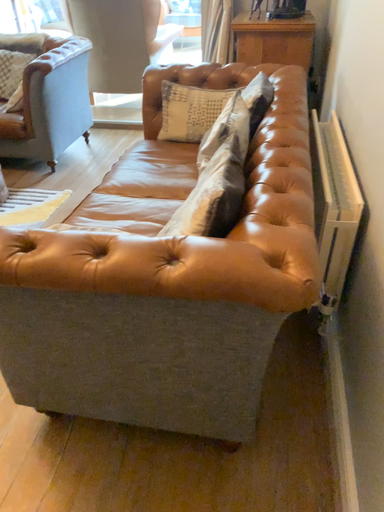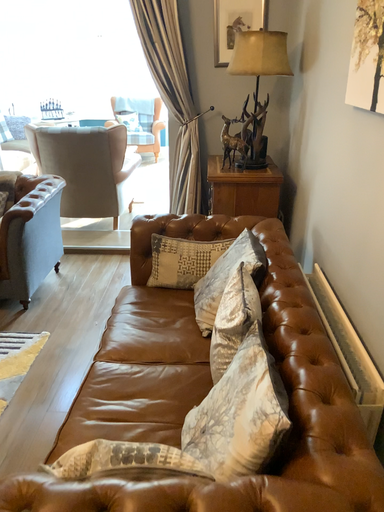
Question: Which way did the camera rotate in the video?

Choices:
 (A) rotated right
 (B) rotated left

Answer: (A)